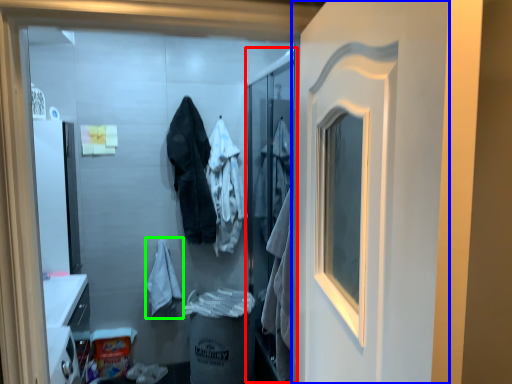
Question: Considering the real-world distances, which object is closest to screen door (highlighted by a red box)? door (highlighted by a blue box) or bathrobe (highlighted by a green box).

Choices:
 (A) door
 (B) bathrobe

Answer: (B)